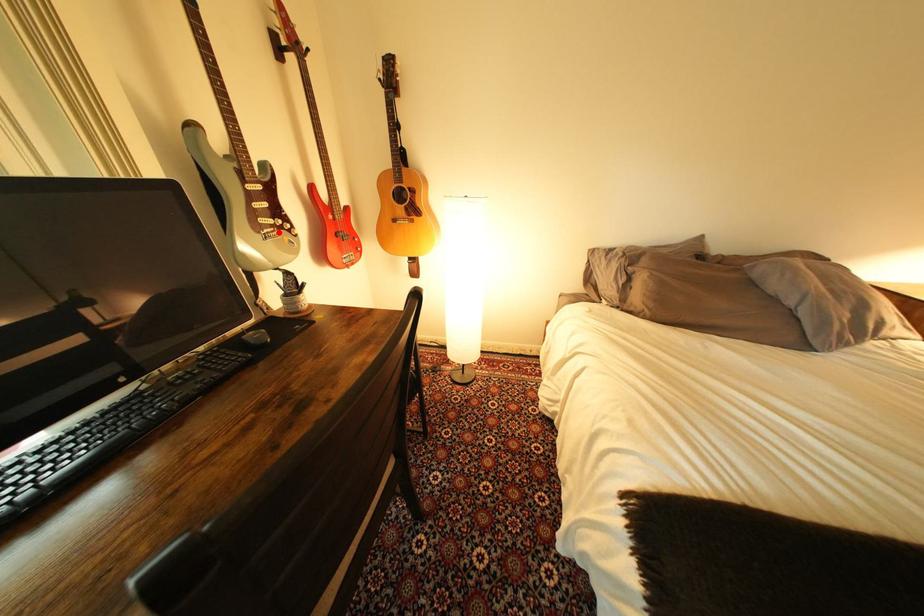
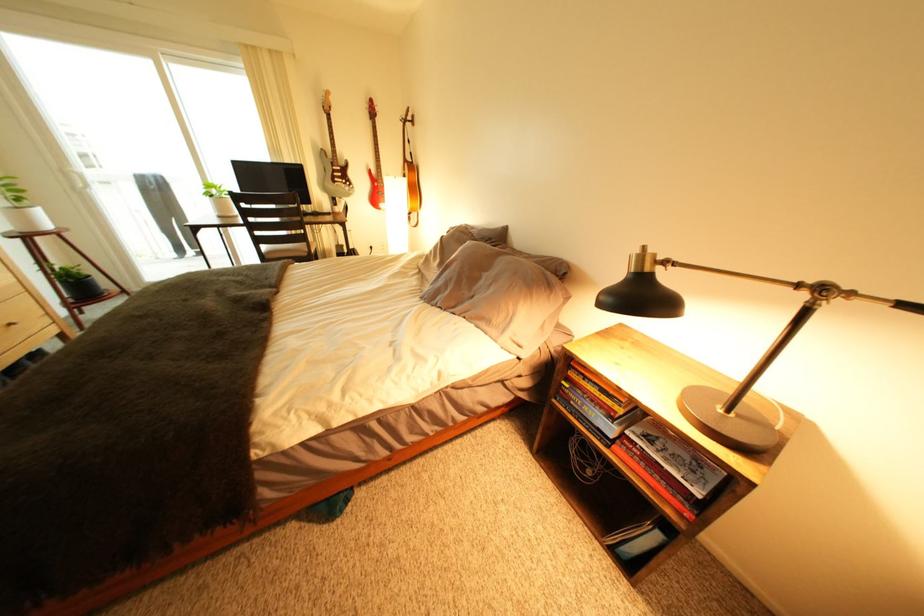
Locate, in the second image, the point that corresponds to the highlighted location in the first image.

(349, 185)